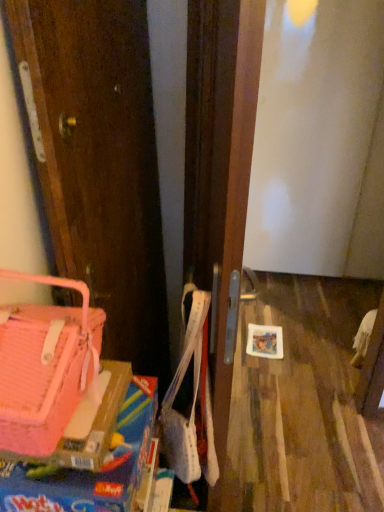
Where is `pink fabric handbag at left`? Image resolution: width=384 pixels, height=512 pixels. pink fabric handbag at left is located at coordinates (45, 366).

Describe the element at coordinates (45, 366) in the screenshot. I see `pink fabric handbag at left` at that location.

Where is `pink plastic box at lower left`? The image size is (384, 512). pink plastic box at lower left is located at coordinates (89, 471).

What do you see at coordinates (89, 471) in the screenshot?
I see `pink plastic box at lower left` at bounding box center [89, 471].

Measure the distance between pink plastic box at lower left and camera.

pink plastic box at lower left and camera are 61.47 centimeters apart from each other.

At what (x,y) coordinates should I click in order to perform the action: click on pink fabric handbag at left. Please return your answer as a coordinate pair (x, y). The width and height of the screenshot is (384, 512). Looking at the image, I should click on pyautogui.click(x=45, y=366).

Considering the positions of objects pink fabric handbag at left and pink plastic box at lower left in the image provided, who is more to the left, pink fabric handbag at left or pink plastic box at lower left?

Positioned to the left is pink fabric handbag at left.

Which object is closer to the camera taking this photo, pink fabric handbag at left or pink plastic box at lower left?

pink fabric handbag at left is closer to the camera.

Does point (55, 393) lie in front of point (2, 480)?

That is True.

From the image's perspective, who appears lower, pink fabric handbag at left or pink plastic box at lower left?

From the image's view, pink plastic box at lower left is below.

From a real-world perspective, who is located higher, pink fabric handbag at left or pink plastic box at lower left?

pink fabric handbag at left is physically above.

Can you confirm if pink fabric handbag at left is wider than pink plastic box at lower left?

No, pink fabric handbag at left is not wider than pink plastic box at lower left.

Is pink fabric handbag at left shorter than pink plastic box at lower left?

Incorrect, the height of pink fabric handbag at left does not fall short of that of pink plastic box at lower left.

From the picture: Based on their sizes in the image, would you say pink fabric handbag at left is bigger or smaller than pink plastic box at lower left?

Considering their sizes, pink fabric handbag at left takes up more space than pink plastic box at lower left.

Is pink fabric handbag at left not within pink plastic box at lower left?

Yes.

Is pink fabric handbag at left in contact with pink plastic box at lower left?

No, pink fabric handbag at left is not with pink plastic box at lower left.

Is pink fabric handbag at left positioned with its back to pink plastic box at lower left?

No.

How many degrees apart are the facing directions of pink fabric handbag at left and pink plastic box at lower left?

They differ by 3.97 degrees in their facing directions.

Measure the distance between pink fabric handbag at left and pink plastic box at lower left.

The distance of pink fabric handbag at left from pink plastic box at lower left is 13.16 centimeters.

Locate an element on the screen. box behind the pink fabric handbag at left is located at coordinates (89, 471).

Between pink plastic box at lower left and pink fabric handbag at left, which one appears on the right side from the viewer's perspective?

pink plastic box at lower left.

Considering their positions, is pink plastic box at lower left located in front of or behind pink fabric handbag at left?

Visually, pink plastic box at lower left is located behind pink fabric handbag at left.

Is point (60, 503) positioned before point (7, 443)?

No, it is behind (7, 443).

Consider the image. From the image's perspective, is pink plastic box at lower left below pink fabric handbag at left?

Indeed, from the image's perspective, pink plastic box at lower left is shown beneath pink fabric handbag at left.

From a real-world perspective, relative to pink fabric handbag at left, is pink plastic box at lower left vertically above or below?

In terms of real-world spatial position, pink plastic box at lower left is below pink fabric handbag at left.

Which of these two, pink plastic box at lower left or pink fabric handbag at left, is thinner?

Thinner between the two is pink fabric handbag at left.

In the scene shown: Is pink plastic box at lower left shorter than pink fabric handbag at left?

Correct, pink plastic box at lower left is not as tall as pink fabric handbag at left.

Is pink plastic box at lower left bigger or smaller than pink fabric handbag at left?

Considering their sizes, pink plastic box at lower left takes up less space than pink fabric handbag at left.

Can pink fabric handbag at left be found inside pink plastic box at lower left?

No, pink fabric handbag at left is located outside of pink plastic box at lower left.

Is pink plastic box at lower left far away from pink fabric handbag at left?

pink plastic box at lower left is near pink fabric handbag at left, not far away.

Is pink plastic box at lower left oriented away from pink fabric handbag at left?

pink plastic box at lower left does not have its back to pink fabric handbag at left.

Can you tell me how much pink plastic box at lower left and pink fabric handbag at left differ in facing direction?

There is a 3.97-degree angle between the facing directions of pink plastic box at lower left and pink fabric handbag at left.

Image resolution: width=384 pixels, height=512 pixels. Identify the location of handbag located above the pink plastic box at lower left (from the image's perspective). (45, 366).

Identify the location of handbag in front of the pink plastic box at lower left. The image size is (384, 512). (45, 366).

Locate an element on the screen. Image resolution: width=384 pixels, height=512 pixels. handbag that is above the pink plastic box at lower left (from a real-world perspective) is located at coordinates (45, 366).